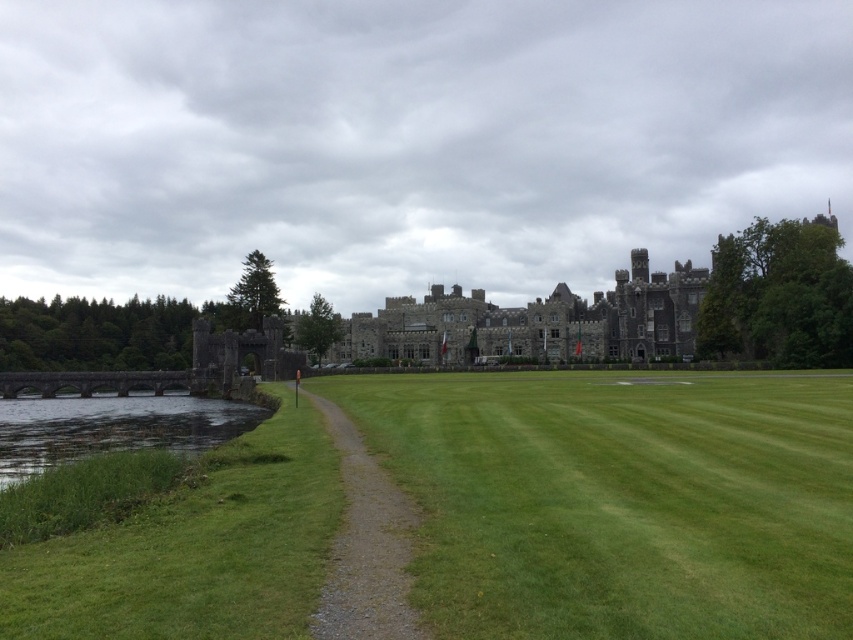
Question: Does green grass at center appear under green grassy water at lower left?

Choices:
 (A) yes
 (B) no

Answer: (B)

Question: Among these points, which one is nearest to the camera?

Choices:
 (A) (608, 568)
 (B) (352, 445)

Answer: (A)

Question: Considering the real-world distances, which object is closest to the green grass at center?

Choices:
 (A) green grassy water at lower left
 (B) gravel path at center

Answer: (B)

Question: Which object appears farthest from the camera in this image?

Choices:
 (A) gravel path at center
 (B) green grass at center

Answer: (A)

Question: Can you confirm if green grass at center is positioned to the left of gravel path at center?

Choices:
 (A) yes
 (B) no

Answer: (B)

Question: Is green grass at center positioned behind gravel path at center?

Choices:
 (A) no
 (B) yes

Answer: (A)